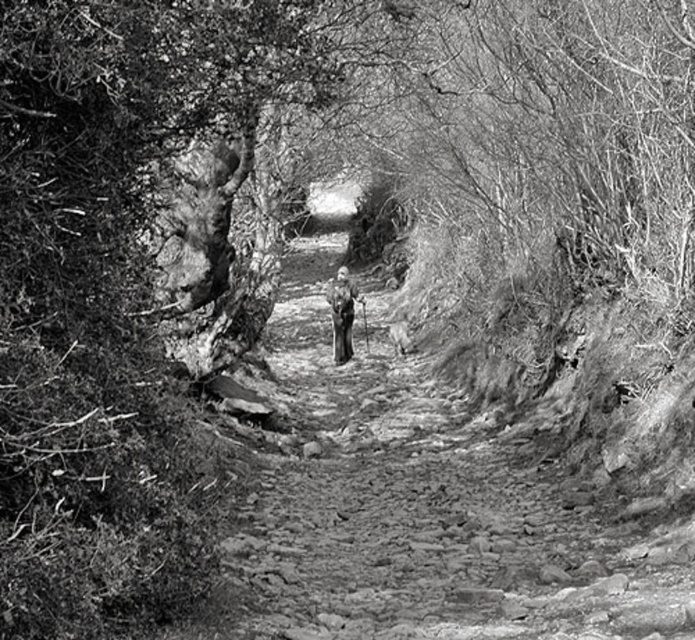
Question: Among these objects, which one is nearest to the camera?

Choices:
 (A) dirt path at center
 (B) dark gray fabric jacket at center

Answer: (A)

Question: Does dirt path at center appear over dark gray fabric jacket at center?

Choices:
 (A) no
 (B) yes

Answer: (A)

Question: Is dirt path at center to the right of dark gray fabric jacket at center from the viewer's perspective?

Choices:
 (A) yes
 (B) no

Answer: (A)

Question: Does dirt path at center have a lesser width compared to dark gray fabric jacket at center?

Choices:
 (A) yes
 (B) no

Answer: (B)

Question: Among these points, which one is farthest from the camera?

Choices:
 (A) (484, 502)
 (B) (329, 298)

Answer: (B)

Question: Among these points, which one is farthest from the camera?

Choices:
 (A) (332, 320)
 (B) (651, 614)

Answer: (A)